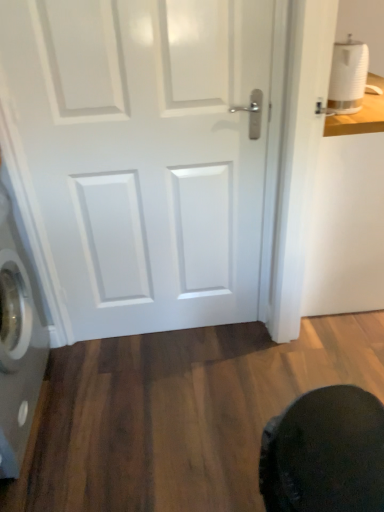
Question: Based on their positions, is silver metallic washing machine at left located to the left or right of white glossy door at center?

Choices:
 (A) right
 (B) left

Answer: (B)

Question: In the image, is silver metallic washing machine at left positioned in front of or behind white glossy door at center?

Choices:
 (A) behind
 (B) front

Answer: (B)

Question: Which object is the closest to the white glossy door at center?

Choices:
 (A) silver metallic washing machine at left
 (B) white matte toilet paper at upper right
 (C) dark fabric swivel chair at lower right

Answer: (A)

Question: Based on their relative distances, which object is farther from the white glossy door at center?

Choices:
 (A) silver metallic washing machine at left
 (B) dark fabric swivel chair at lower right
 (C) white matte toilet paper at upper right

Answer: (B)